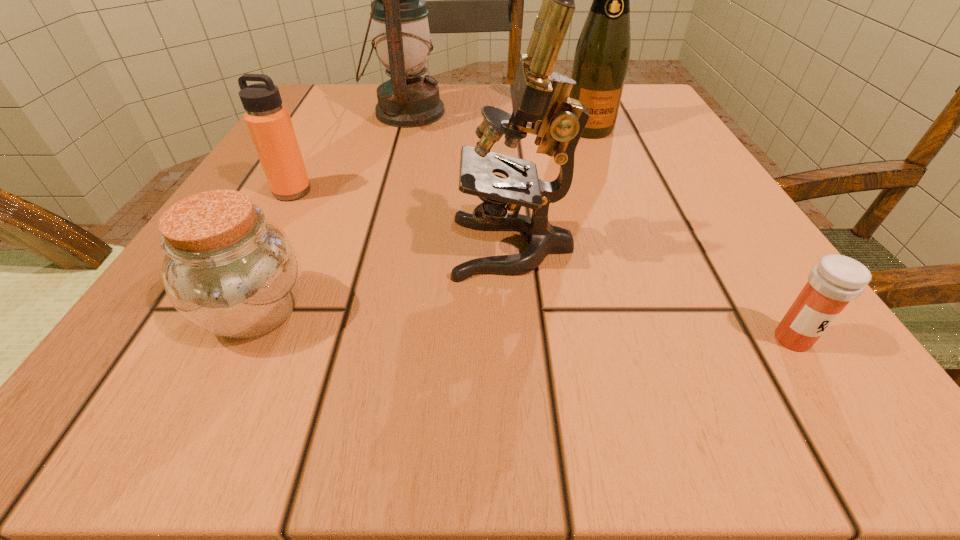
Identify the location of vacant space located at the eyepieces of the third object from right to left. This screenshot has height=540, width=960. (309, 247).

Where is `vacant area situated at the eyepieces of the third object from right to left`? This screenshot has height=540, width=960. vacant area situated at the eyepieces of the third object from right to left is located at coordinates (226, 247).

Where is `vacant space located at the eyepieces of the third object from right to left`? The height and width of the screenshot is (540, 960). vacant space located at the eyepieces of the third object from right to left is located at coordinates (407, 247).

At what (x,y) coordinates should I click in order to perform the action: click on free space located 0.270m on the right of the fourth tallest object. Please return your answer as a coordinate pair (x, y). This screenshot has width=960, height=540. Looking at the image, I should click on (487, 191).

The image size is (960, 540). Find the location of `free location located on the right of the jar`. free location located on the right of the jar is located at coordinates (382, 311).

Find the location of a particular element. This screenshot has height=540, width=960. vacant space located 0.070m on the label side of the rightmost object is located at coordinates (843, 417).

You are a GUI agent. You are given a task and a screenshot of the screen. Output one action in this format:
    pyautogui.click(x=<x>, y=<y>)
    Task: Click on the wine bottle that is at the far edge
    Image resolution: width=960 pixels, height=540 pixels.
    Given the screenshot: What is the action you would take?
    pyautogui.click(x=601, y=58)

Locate an element on the screen. This screenshot has height=540, width=960. oil lamp that is at the far edge is located at coordinates (402, 40).

Locate an element on the screen. The image size is (960, 540). jar that is at the near edge is located at coordinates (228, 270).

Where is `medicine positioned at the near edge`? medicine positioned at the near edge is located at coordinates (836, 280).